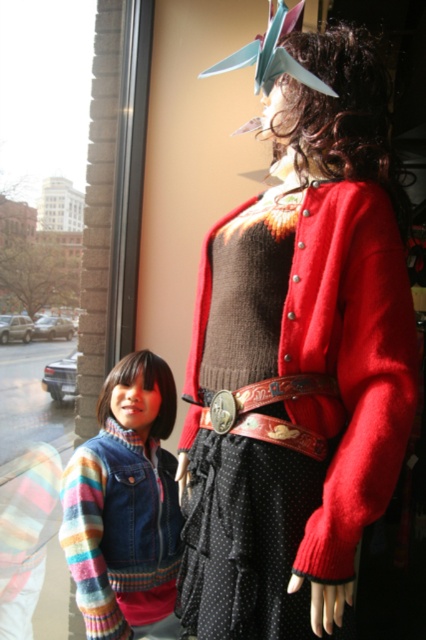
Question: Which object is the farthest from the leather/embossed belt at center?

Choices:
 (A) red woolen sweater at center
 (B) denim jacket at lower left

Answer: (B)

Question: Among these points, which one is farthest from the camera?

Choices:
 (A) (325, 381)
 (B) (307, 218)

Answer: (B)

Question: Does denim jacket at lower left lie in front of leather/embossed belt at center?

Choices:
 (A) yes
 (B) no

Answer: (B)

Question: Estimate the real-world distances between objects in this image. Which object is farther from the leather/embossed belt at center?

Choices:
 (A) red woolen sweater at center
 (B) denim jacket at lower left

Answer: (B)

Question: Does red woolen sweater at center appear on the right side of denim jacket at lower left?

Choices:
 (A) no
 (B) yes

Answer: (B)

Question: Is red woolen sweater at center positioned in front of denim jacket at lower left?

Choices:
 (A) no
 (B) yes

Answer: (B)